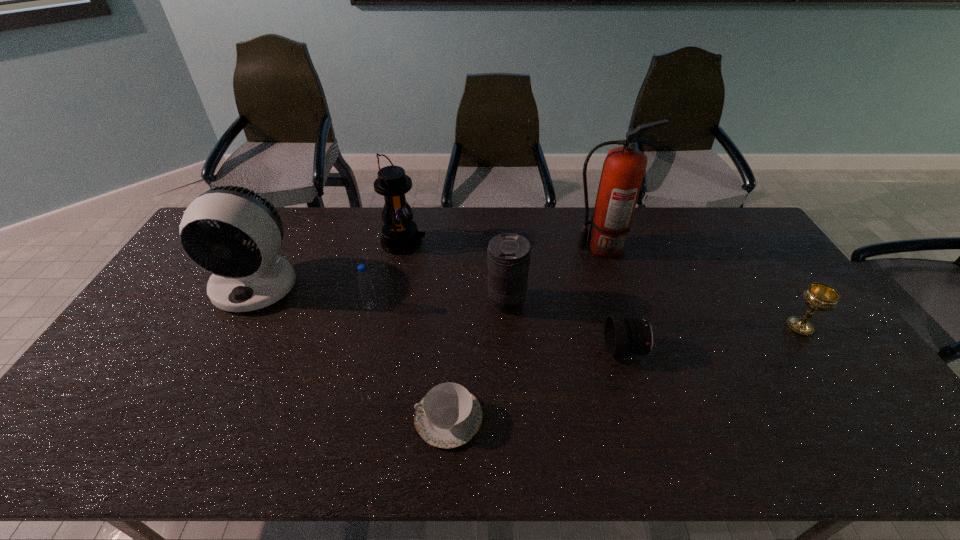
The image size is (960, 540). Identify the location of object positioned at the left edge. (242, 280).

Identify the location of object present at the right edge. (818, 296).

What are the coordinates of `vacant area at the far edge of the desktop` in the screenshot? It's located at (440, 239).

This screenshot has height=540, width=960. I want to click on blank space at the near edge, so click(x=604, y=448).

This screenshot has height=540, width=960. Find the location of `free space at the left edge of the desktop`. free space at the left edge of the desktop is located at coordinates (91, 422).

Locate an element on the screen. This screenshot has width=960, height=540. vacant area at the near right corner is located at coordinates (883, 438).

Image resolution: width=960 pixels, height=540 pixels. Identify the location of free space between the fire extinguisher and the fan. (429, 266).

In order to click on free point between the chalice and the water bottle in this screenshot , I will do `click(585, 317)`.

In order to click on free space that is in between the chalice and the fire extinguisher in this screenshot , I will do `click(700, 287)`.

Where is `empty space between the leftmost object and the lantern`? empty space between the leftmost object and the lantern is located at coordinates (330, 264).